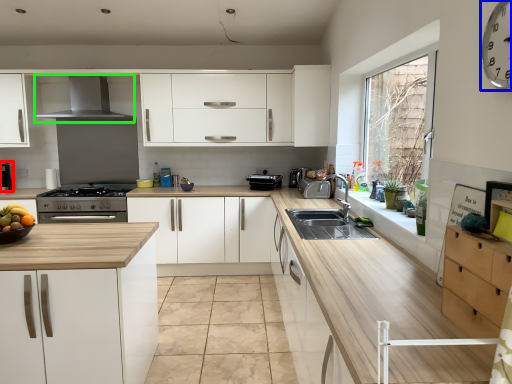
Question: Considering the real-world distances, which object is farthest from coffee machine (highlighted by a red box)? clock (highlighted by a blue box) or exhaust hood (highlighted by a green box)?

Choices:
 (A) clock
 (B) exhaust hood

Answer: (A)